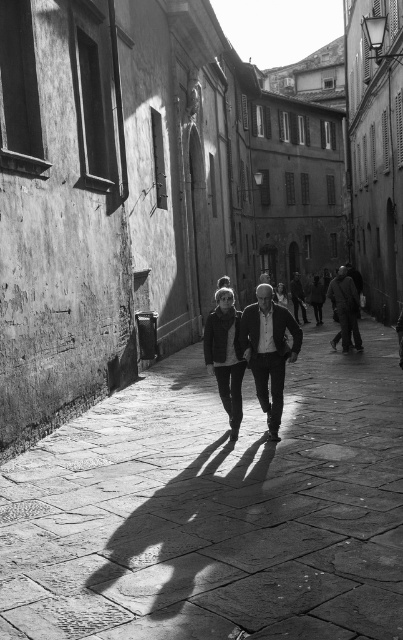
Which of these two, smooth stone pavement at center or matte black jacket at center, stands shorter?

With less height is smooth stone pavement at center.

Between smooth stone pavement at center and matte black jacket at center, which one is positioned lower?

smooth stone pavement at center

Find the location of a particular element. The image size is (403, 640). smooth stone pavement at center is located at coordinates (214, 509).

Identify the location of smooth stone pavement at center. (214, 509).

At what (x,y) coordinates should I click in order to perform the action: click on matte black jacket at center. Please return your answer as a coordinate pair (x, y). The height and width of the screenshot is (640, 403). Looking at the image, I should click on (226, 355).

Between matte black jacket at center and dark textured coat at right, which one has more height?

With more height is dark textured coat at right.

Is point (228, 369) closer to camera compared to point (344, 291)?

Yes, point (228, 369) is closer to viewer.

Locate an element on the screen. Image resolution: width=403 pixels, height=640 pixels. matte black jacket at center is located at coordinates (226, 355).

Is smooth stone pavement at center to the left of dark textured coat at right from the viewer's perspective?

Indeed, smooth stone pavement at center is positioned on the left side of dark textured coat at right.

Image resolution: width=403 pixels, height=640 pixels. What do you see at coordinates (214, 509) in the screenshot?
I see `smooth stone pavement at center` at bounding box center [214, 509].

Locate an element on the screen. The image size is (403, 640). smooth stone pavement at center is located at coordinates (214, 509).